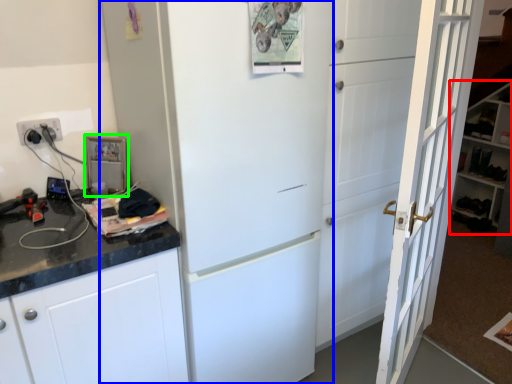
Question: Based on their relative distances, which object is farther from bookshelf (highlighted by a red box)? Choose from refrigerator (highlighted by a blue box) and appliance (highlighted by a green box).

Choices:
 (A) refrigerator
 (B) appliance

Answer: (B)